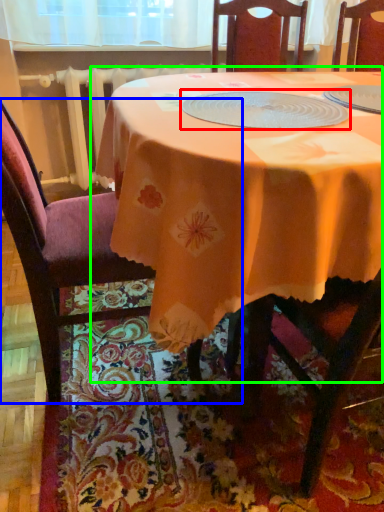
Question: Estimate the real-world distances between objects in this image. Which object is farther from tableware (highlighted by a red box), chair (highlighted by a blue box) or table (highlighted by a green box)?

Choices:
 (A) chair
 (B) table

Answer: (A)